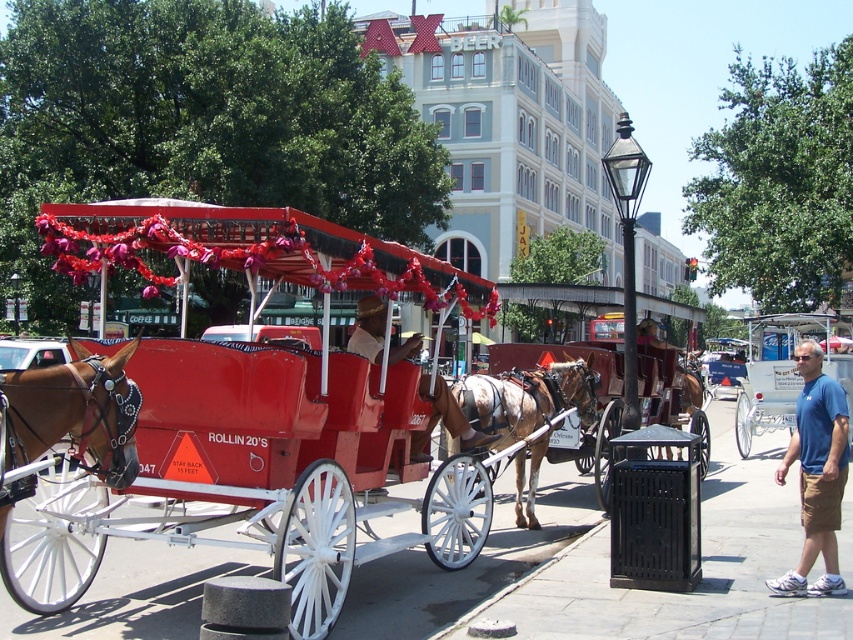
What is the significance of the point labeled at coordinates (258, 416) in the image?

The point labeled at coordinates (258, 416) indicates the location of the shiny red carriage at center.

You are standing on the sidewalk next to the red horse drawn carriage. You want to take a photo of both the brown speckled horse at center and the white polished wood wagon at center without getting too close. According to the warning sign, how far back should you stand to safely capture both in your shot?

The warning sign says to stay back 15 feet. To safely capture both the brown speckled horse at center and the white polished wood wagon at center in your photo, you should stand at least 15 feet away from the carriage.

You are standing on the sidewalk and see the shiny red carriage at center and the brown glossy horse at left. Which object is closer to you?

The shiny red carriage at center is closer to you because it is positioned under the brown glossy horse at left, meaning the horse is behind the carriage.